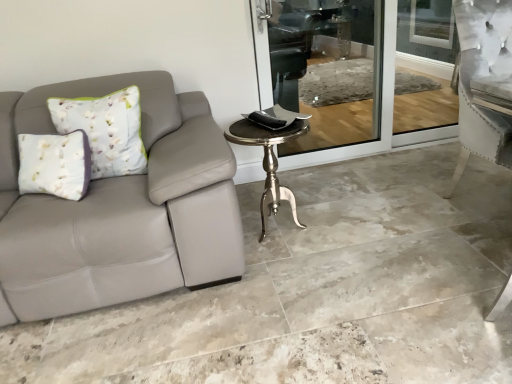
Locate an element on the screen. Image resolution: width=512 pixels, height=384 pixels. free space in front of polished brass table at center is located at coordinates (292, 276).